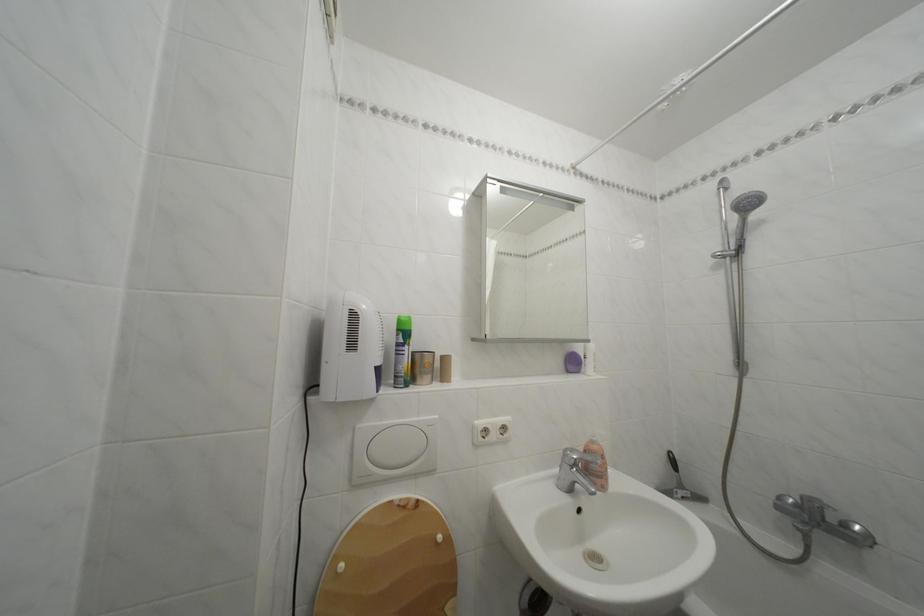
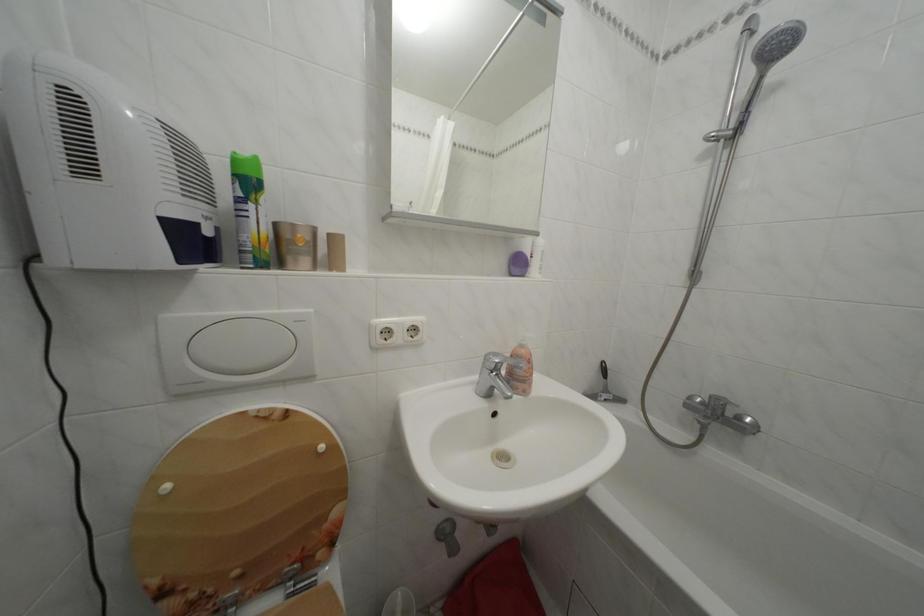
In the second image, find the point that corresponds to point 350,573 in the first image.

(176, 493)